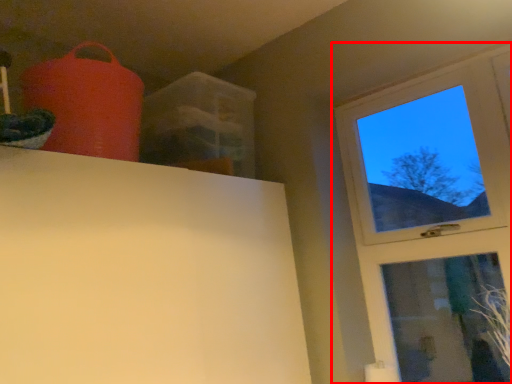
Question: From the image's perspective, where is window (annotated by the red box) located in relation to plant in the image?

Choices:
 (A) above
 (B) below

Answer: (A)